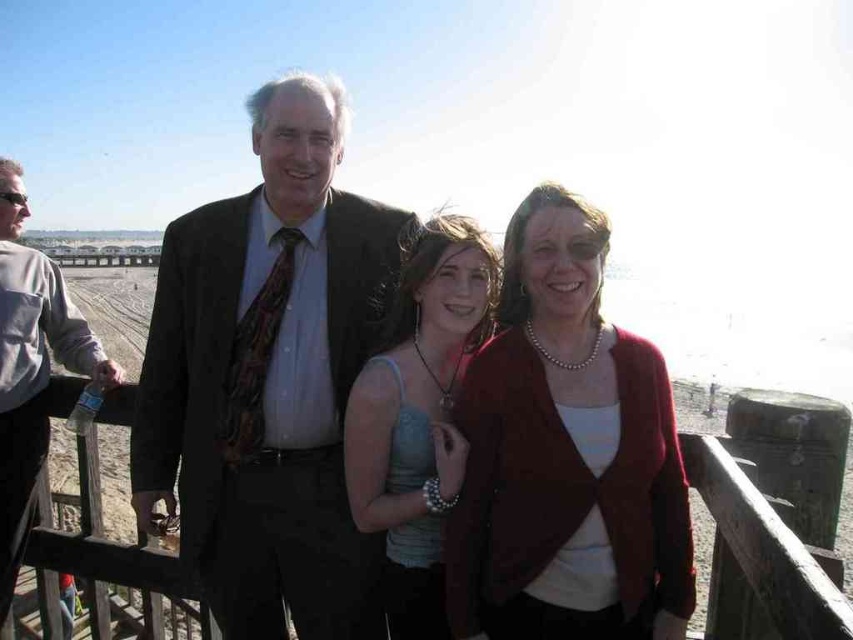
Question: Considering the relative positions of matte black suit at center and wooden at center in the image provided, where is matte black suit at center located with respect to wooden at center?

Choices:
 (A) below
 (B) above

Answer: (B)

Question: Can you confirm if matte black suit at center is positioned to the left of matte red cardigan at center?

Choices:
 (A) yes
 (B) no

Answer: (A)

Question: Which point is farther from the camera taking this photo?

Choices:
 (A) pyautogui.click(x=688, y=468)
 (B) pyautogui.click(x=354, y=452)
 (C) pyautogui.click(x=212, y=337)

Answer: (C)

Question: Does matte black suit at center appear on the right side of gray sweatshirt at left?

Choices:
 (A) yes
 (B) no

Answer: (A)

Question: Which point is closer to the camera?

Choices:
 (A) wooden at center
 (B) gray sweatshirt at left
 (C) matte black suit at center
 (D) matte blue tank top at center

Answer: (A)

Question: Which of the following is the closest to the observer?

Choices:
 (A) matte red cardigan at center
 (B) matte blue tank top at center
 (C) wooden at center

Answer: (C)